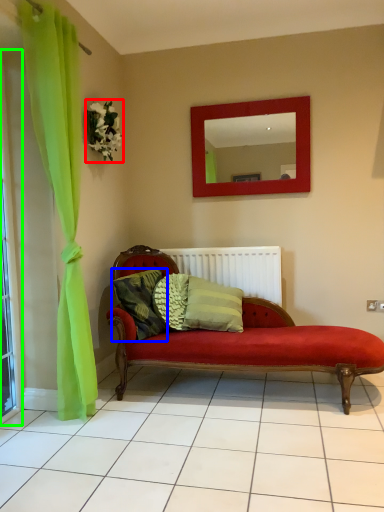
Question: Which object is positioned farthest from flower (highlighted by a red box)? Select from pillow (highlighted by a blue box) and window frame (highlighted by a green box).

Choices:
 (A) pillow
 (B) window frame

Answer: (A)